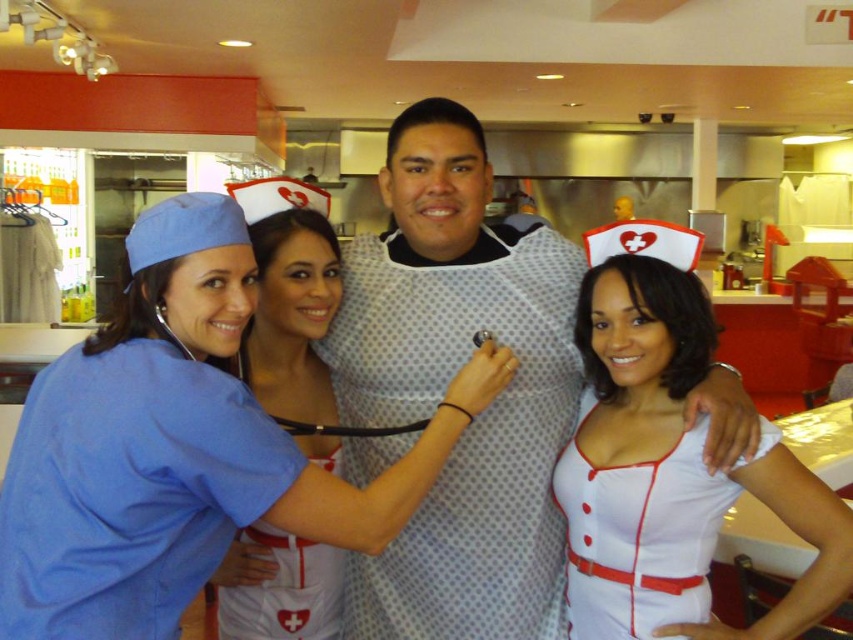
You are standing in the restaurant kitchen scene. There is a point at coordinates (x=445, y=387). Which object is this point located on?

The point at coordinates (x=445, y=387) is located on the white dotted shirt at center.

You are standing in the restaurant kitchen and want to move from the point closer to you to the point further away. Which path should you take to go from the point at coordinates point (281, 445) to the point at coordinates point (670, 532)?

The path should go from point (281, 445) to point (670, 532) since point (281, 445) is closer to the viewer and point (670, 532) is further away.